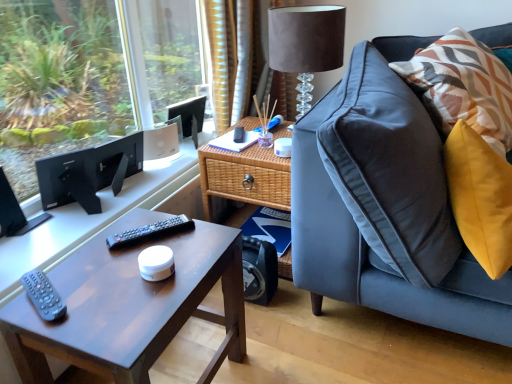
What are the coordinates of `free space to the back side of black plastic remote at lower left, the first remote from the left` in the screenshot? It's located at (81, 262).